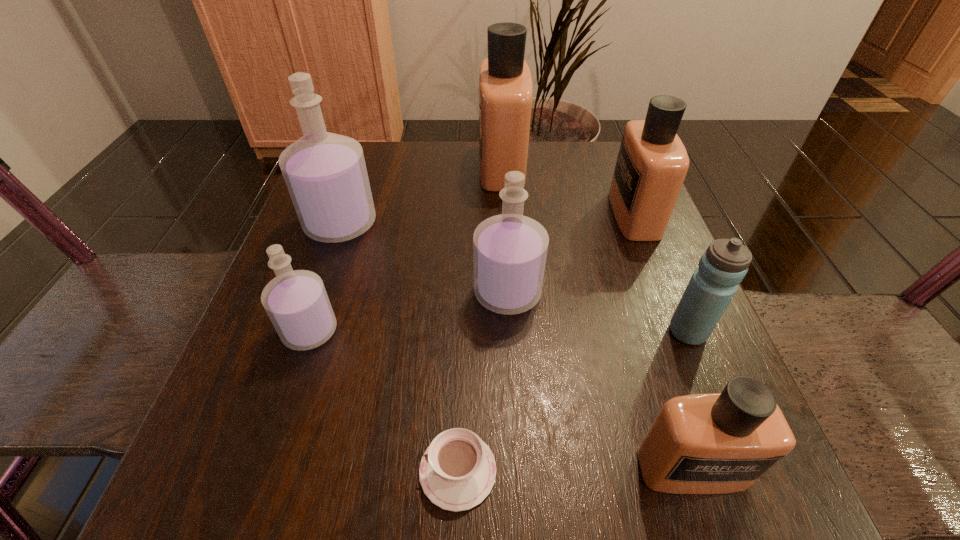
Image resolution: width=960 pixels, height=540 pixels. Identify the location of the leftmost beige perfume. (505, 83).

Where is `the farthest purple perfume`? This screenshot has width=960, height=540. the farthest purple perfume is located at coordinates (325, 173).

Where is `the rightmost purple perfume`? This screenshot has width=960, height=540. the rightmost purple perfume is located at coordinates (510, 250).

Where is `the second biggest beige perfume`? This screenshot has width=960, height=540. the second biggest beige perfume is located at coordinates (652, 163).

Identify the location of water bottle. The image size is (960, 540). (724, 264).

Image resolution: width=960 pixels, height=540 pixels. I want to click on the smallest purple perfume, so click(x=296, y=302).

Where is `the nearest perfume`? The image size is (960, 540). the nearest perfume is located at coordinates (720, 443).

Where is `the smallest beige perfume`? Image resolution: width=960 pixels, height=540 pixels. the smallest beige perfume is located at coordinates (720, 443).

The image size is (960, 540). Identify the location of teacup. point(457,471).

The image size is (960, 540). What are the coordinates of `free space located on the front label of the biggest beige perfume` in the screenshot? It's located at (403, 166).